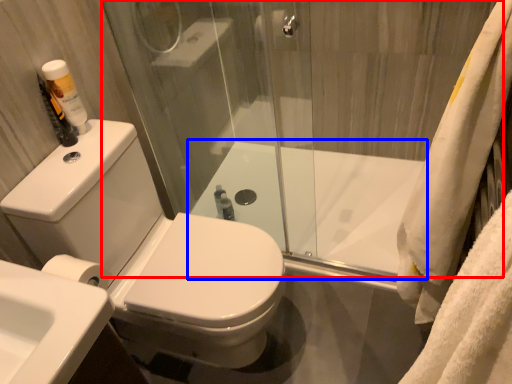
Question: Which point is closer to the camera, shower door (highlighted by a red box) or bath (highlighted by a blue box)?

Choices:
 (A) shower door
 (B) bath

Answer: (A)